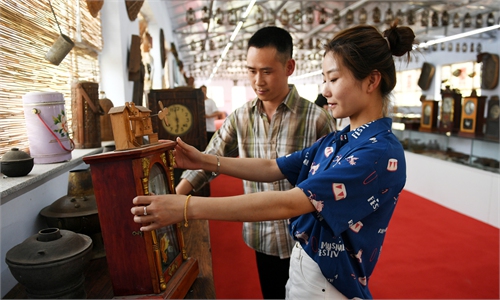
You are a GUI agent. You are given a task and a screenshot of the screen. Output one action in this format:
    pyautogui.click(x=<x>, y=<y>)
    Task: Click on the red carpet
    The height and width of the screenshot is (300, 500).
    Given the screenshot: What is the action you would take?
    pyautogui.click(x=416, y=251)